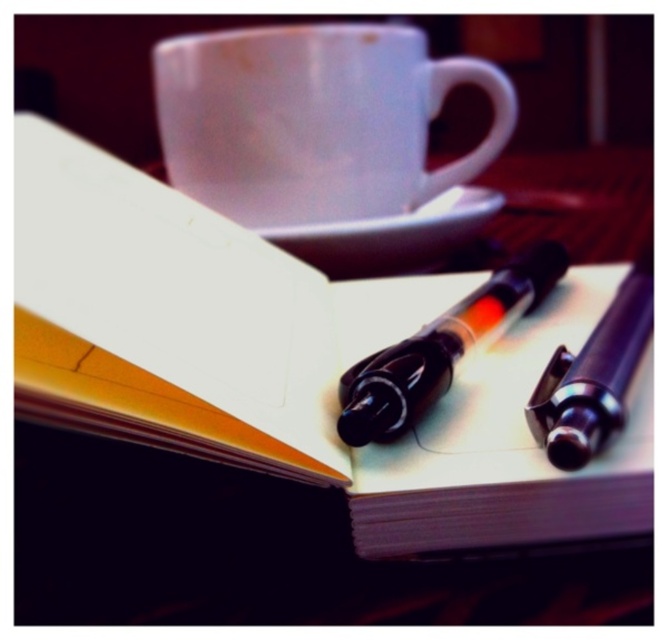
You are setting up a new workspace and want to ensure there is enough space for both the white glossy mug at upper center and the white ceramic saucer at center. Given that the saucer is smaller, can you confirm if the mug will fit on the saucer without overhanging?

The white glossy mug at upper center is larger in size than the white ceramic saucer at center, so placing the mug on the saucer would cause it to overhang the edges since the saucer is smaller.

You are an AI analyzing the workspace setup. The coordinate system has the origin at the bottom left corner of the image. The white glossy mug at upper center is located at which coordinates?

The white glossy mug at upper center is located at coordinates point (313, 120).